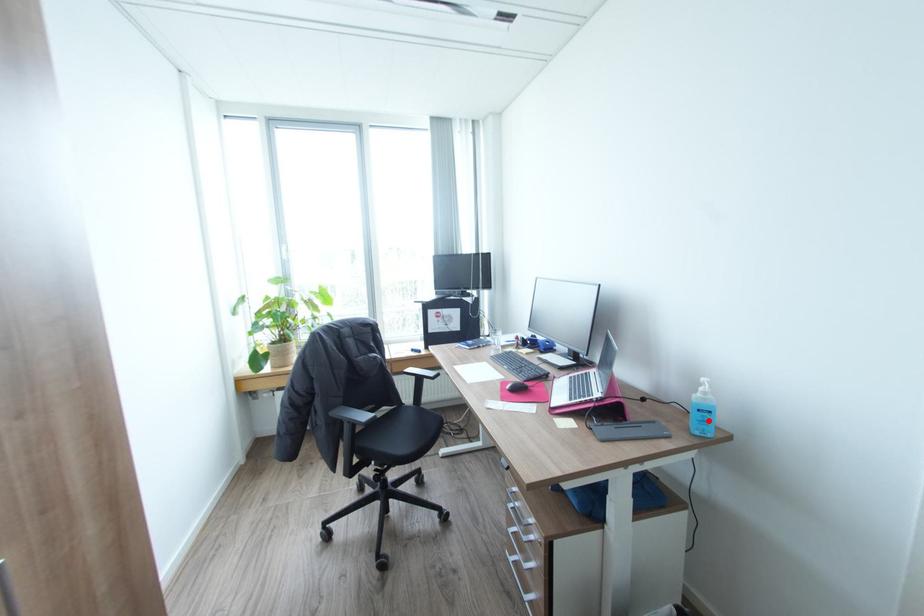
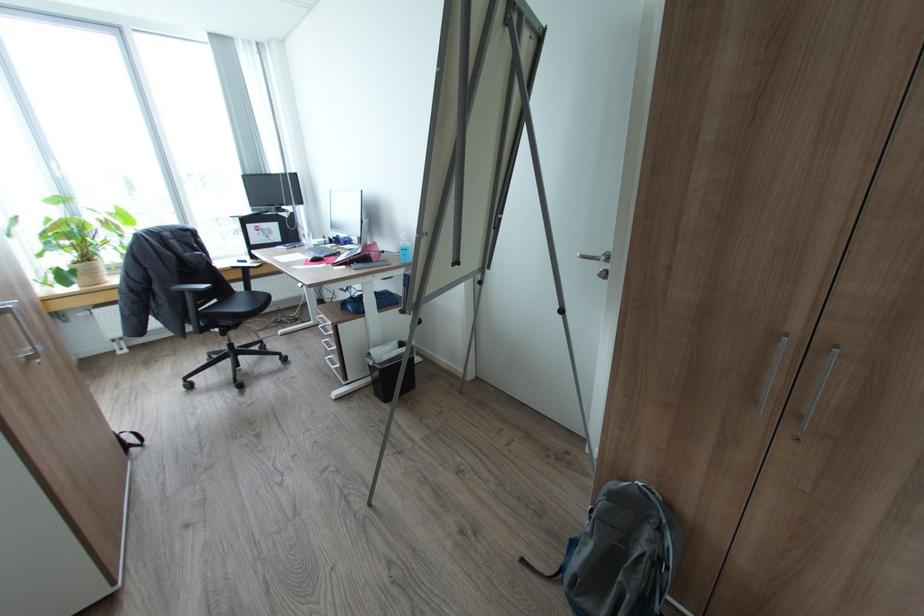
Locate, in the second image, the point that corresponds to the highlighted location in the first image.

(408, 254)